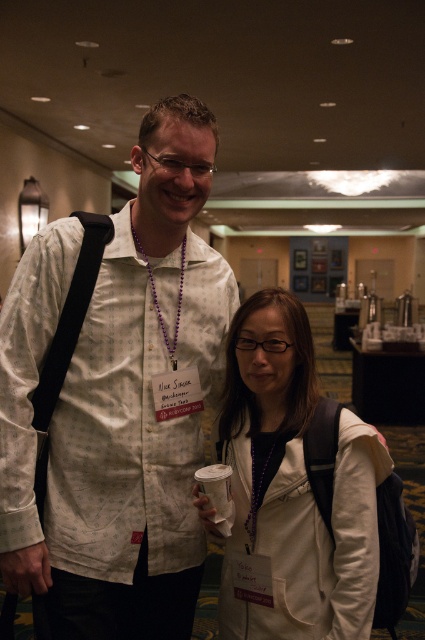
You are a photographer at a conference trying to capture a clear shot of both the white printed shirt at center and the white matte jacket at center. Since both are white, you need to adjust your camera settings to account for their sizes. Which object should you focus on first to ensure proper exposure, considering their relative sizes?

The white printed shirt at center is much taller than the white matte jacket at center, so you should focus on the white printed shirt at center first to ensure proper exposure, as larger objects may require different exposure settings.

You are organizing a photoshoot and need to decide which item to place in the foreground for better visibility. Based on the scene description, which item between the white matte jacket at center and the purple beaded necklace at center would you choose and why?

The white matte jacket at center is wider than the purple beaded necklace at center, so it would be more visible in the foreground.

You are a photographer at the event and need to capture a clear photo of the white matte jacket at center and the purple beaded necklace at center. Which object should you focus on first to ensure it appears sharp in the photo?

The white matte jacket at center should be focused on first because it is positioned under the purple beaded necklace at center, making it closer to the camera. Focusing on the closer object ensures sharpness for both due to depth of field.